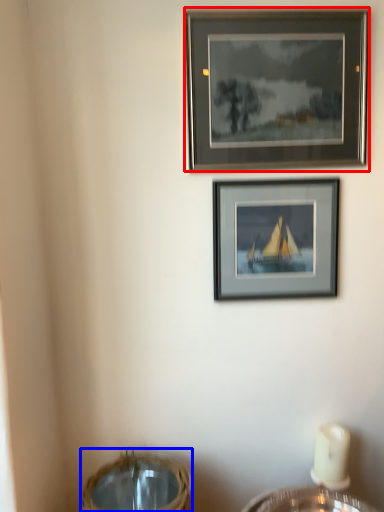
Question: Which object appears closest to the camera in this image, picture frame (highlighted by a red box) or basket (highlighted by a blue box)?

Choices:
 (A) picture frame
 (B) basket

Answer: (B)